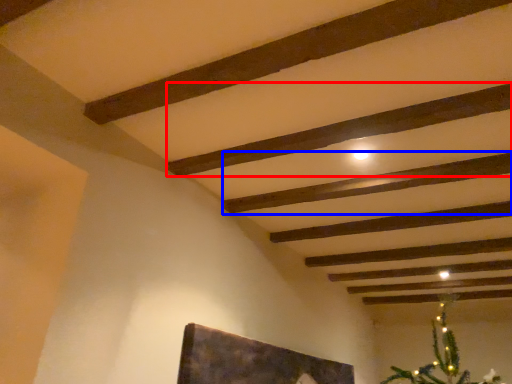
Question: Which object is further to the camera taking this photo, plank (highlighted by a red box) or plank (highlighted by a blue box)?

Choices:
 (A) plank
 (B) plank

Answer: (B)